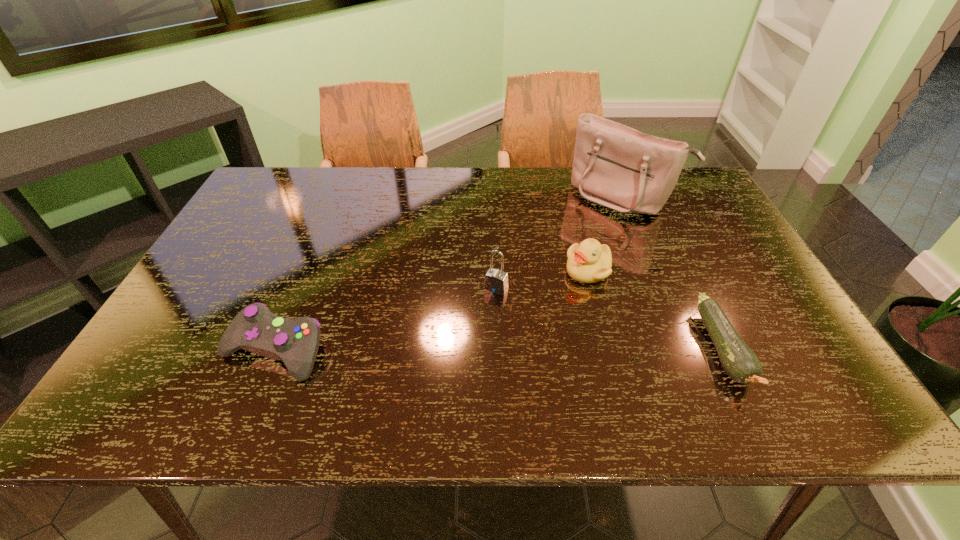
Where is `control`? This screenshot has height=540, width=960. control is located at coordinates (255, 328).

The height and width of the screenshot is (540, 960). Identify the location of the second shortest object. (255, 328).

Identify the location of zucchini. (739, 361).

This screenshot has width=960, height=540. What are the coordinates of `duckling` in the screenshot? It's located at click(x=588, y=262).

The image size is (960, 540). I want to click on the second object from left to right, so click(496, 281).

Locate an element on the screen. padlock is located at coordinates (496, 281).

The width and height of the screenshot is (960, 540). Find the location of `shoulder bag`. shoulder bag is located at coordinates (616, 166).

Locate an element on the screen. The image size is (960, 540). the farthest object is located at coordinates (616, 166).

Where is `free point located 0.390m on the right of the leftmost object`? The image size is (960, 540). free point located 0.390m on the right of the leftmost object is located at coordinates (501, 350).

Where is `free spot located on the beak of the duckling`? This screenshot has width=960, height=540. free spot located on the beak of the duckling is located at coordinates (546, 362).